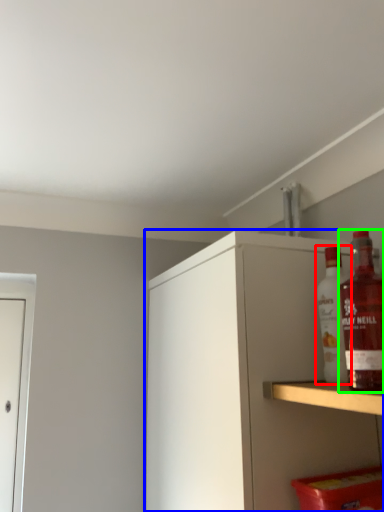
Question: Based on their relative distances, which object is nearer to bottle (highlighted by a red box)? Choose from cabinetry (highlighted by a blue box) and bottle (highlighted by a green box).

Choices:
 (A) cabinetry
 (B) bottle

Answer: (B)